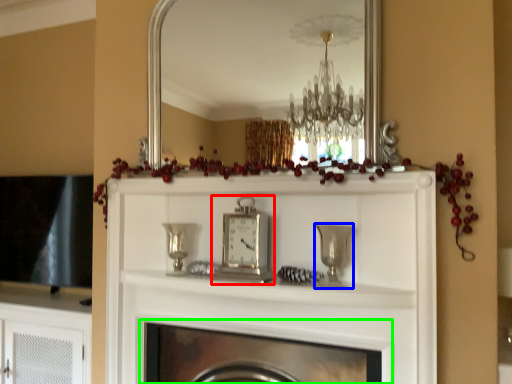
Question: Considering the real-world distances, which object is closest to clock (highlighted by a red box)? candle holder (highlighted by a blue box) or fireplace (highlighted by a green box).

Choices:
 (A) candle holder
 (B) fireplace

Answer: (A)